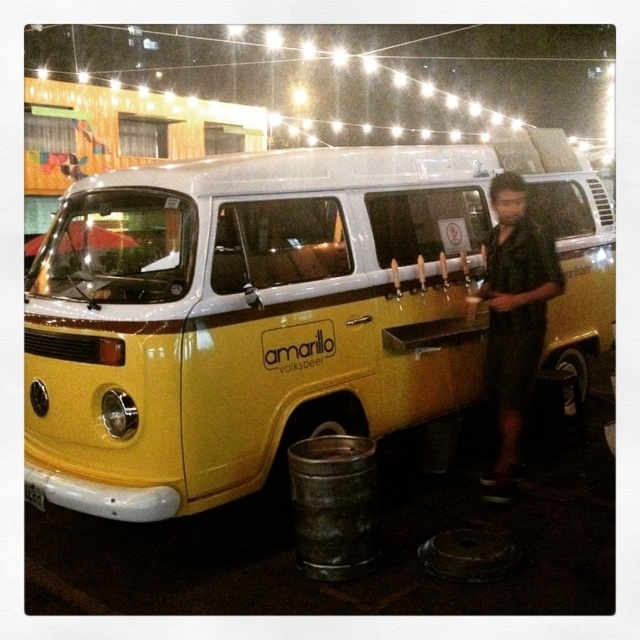
You are a customer at an outdoor event and want to place your drink on a flat surface. The yellow matte van at center and the rusty metal barrel at lower center are nearby. Which object can you use to place your drink?

The rusty metal barrel at lower center can be used to place your drink because the yellow matte van at center is positioned over it, meaning the barrel is lower and likely has a flat surface accessible for placing items.

You are a delivery person who needs to move a large box from the rusty metal barrel at lower center to the yellow matte van at center. The box is 6 feet long. Can you move it without tilting the box sideways? Explain why or why not based on the distance between them.

The yellow matte van at center and rusty metal barrel at lower center are 6.34 feet apart. Since the box is 6 feet long, it can be moved horizontally between them without tilting because the distance between the two objects is greater than the box length.